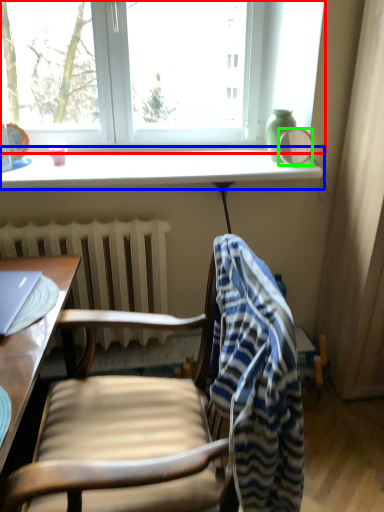
Question: Based on their relative distances, which object is nearer to window (highlighted by a red box)? Choose from window sill (highlighted by a blue box) and mirror (highlighted by a green box).

Choices:
 (A) window sill
 (B) mirror

Answer: (A)